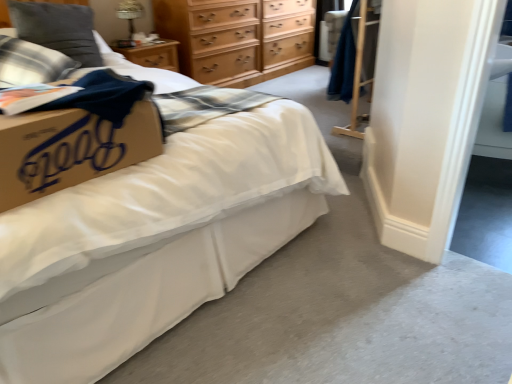
The height and width of the screenshot is (384, 512). Identify the location of plush gray pillow at upper left, which ranks as the 1th pillow in top-to-bottom order. (58, 29).

Measure the distance between white matte bed at center and camera.

The distance of white matte bed at center from camera is 38.50 inches.

At what (x,y) coordinates should I click in order to perform the action: click on white matte bed at center. Please return your answer as a coordinate pair (x, y). This screenshot has width=512, height=384. Looking at the image, I should click on (154, 241).

At what (x,y) coordinates should I click in order to perform the action: click on plush gray pillow at upper left, which is the 2th pillow in bottom-to-top order. Please return your answer as a coordinate pair (x, y). This screenshot has width=512, height=384. Looking at the image, I should click on (58, 29).

How many degrees apart are the facing directions of plush gray pillow at upper left, which is the 2th pillow in bottom-to-top order, and light brown wooden chest of drawers at upper center?

plush gray pillow at upper left, which is the 2th pillow in bottom-to-top order, and light brown wooden chest of drawers at upper center are facing 5.44 degrees away from each other.

Who is shorter, plush gray pillow at upper left, which is the 2th pillow in bottom-to-top order, or light brown wooden chest of drawers at upper center?

With less height is plush gray pillow at upper left, which is the 2th pillow in bottom-to-top order.

Looking at their sizes, would you say plush gray pillow at upper left, which is the 2th pillow in bottom-to-top order, is wider or thinner than light brown wooden chest of drawers at upper center?

Clearly, plush gray pillow at upper left, which is the 2th pillow in bottom-to-top order, has less width compared to light brown wooden chest of drawers at upper center.

Consider the image. Is light brown wooden chest of drawers at upper center with plaid fabric pillow at upper left, acting as the second pillow starting from the top?

No, light brown wooden chest of drawers at upper center is not in contact with plaid fabric pillow at upper left, acting as the second pillow starting from the top.

Considering the sizes of objects light brown wooden chest of drawers at upper center and plaid fabric pillow at upper left, which appears as the first pillow when ordered from the bottom, in the image provided, who is smaller, light brown wooden chest of drawers at upper center or plaid fabric pillow at upper left, which appears as the first pillow when ordered from the bottom,?

With smaller size is plaid fabric pillow at upper left, which appears as the first pillow when ordered from the bottom.

Is light brown wooden chest of drawers at upper center in front of or behind plaid fabric pillow at upper left, which appears as the first pillow when ordered from the bottom, in the image?

Visually, light brown wooden chest of drawers at upper center is located behind plaid fabric pillow at upper left, which appears as the first pillow when ordered from the bottom.

Measure the distance from light brown wooden chest of drawers at upper center to plaid fabric pillow at upper left, acting as the second pillow starting from the top.

light brown wooden chest of drawers at upper center and plaid fabric pillow at upper left, acting as the second pillow starting from the top, are 1.60 meters apart from each other.

Between plaid fabric pillow at upper left, acting as the second pillow starting from the top, and light brown wooden chest of drawers at upper center, which one is positioned behind?

light brown wooden chest of drawers at upper center is behind.

Is plaid fabric pillow at upper left, acting as the second pillow starting from the top, oriented away from light brown wooden chest of drawers at upper center?

plaid fabric pillow at upper left, acting as the second pillow starting from the top, does not have its back to light brown wooden chest of drawers at upper center.

Between plaid fabric pillow at upper left, acting as the second pillow starting from the top, and light brown wooden chest of drawers at upper center, which one has more height?

With more height is light brown wooden chest of drawers at upper center.

From a real-world perspective, between plaid fabric pillow at upper left, acting as the second pillow starting from the top, and light brown wooden chest of drawers at upper center, who is vertically lower?

light brown wooden chest of drawers at upper center, from a real-world perspective.

Is the position of white matte bed at center less distant than that of plush gray pillow at upper left, which ranks as the 1th pillow in top-to-bottom order?

Yes, the depth of white matte bed at center is less than that of plush gray pillow at upper left, which ranks as the 1th pillow in top-to-bottom order.

Between white matte bed at center and plush gray pillow at upper left, which ranks as the 1th pillow in top-to-bottom order, which one has less height?

Standing shorter between the two is plush gray pillow at upper left, which ranks as the 1th pillow in top-to-bottom order.

Considering the sizes of objects white matte bed at center and plush gray pillow at upper left, which ranks as the 1th pillow in top-to-bottom order, in the image provided, who is wider, white matte bed at center or plush gray pillow at upper left, which ranks as the 1th pillow in top-to-bottom order,?

With larger width is white matte bed at center.

Does point (170, 152) lie behind point (46, 30)?

No.

Looking at this image, which of these two, light brown wooden chest of drawers at upper center or white matte bed at center, is thinner?

light brown wooden chest of drawers at upper center.

The height and width of the screenshot is (384, 512). In order to click on bed in front of the light brown wooden chest of drawers at upper center in this screenshot , I will do `click(154, 241)`.

From the image's perspective, is light brown wooden chest of drawers at upper center on top of white matte bed at center?

Yes, from the image's perspective, light brown wooden chest of drawers at upper center is above white matte bed at center.

Looking at this image, does plaid fabric pillow at upper left, acting as the second pillow starting from the top, have a larger size compared to plush gray pillow at upper left, which is the 2th pillow in bottom-to-top order?

Yes.

From a real-world perspective, who is located higher, plaid fabric pillow at upper left, which appears as the first pillow when ordered from the bottom, or plush gray pillow at upper left, which ranks as the 1th pillow in top-to-bottom order?

plush gray pillow at upper left, which ranks as the 1th pillow in top-to-bottom order, from a real-world perspective.

From the image's perspective, between plaid fabric pillow at upper left, acting as the second pillow starting from the top, and plush gray pillow at upper left, which ranks as the 1th pillow in top-to-bottom order, who is located below?

plaid fabric pillow at upper left, acting as the second pillow starting from the top, appears lower in the image.

In terms of width, does plaid fabric pillow at upper left, which appears as the first pillow when ordered from the bottom, look wider or thinner when compared to plush gray pillow at upper left, which is the 2th pillow in bottom-to-top order?

In the image, plaid fabric pillow at upper left, which appears as the first pillow when ordered from the bottom, appears to be wider than plush gray pillow at upper left, which is the 2th pillow in bottom-to-top order.

Is plaid fabric pillow at upper left, acting as the second pillow starting from the top, to the left or to the right of white matte bed at center in the image?

plaid fabric pillow at upper left, acting as the second pillow starting from the top, is to the left of white matte bed at center.

Is the depth of plaid fabric pillow at upper left, which appears as the first pillow when ordered from the bottom, less than that of white matte bed at center?

No, it is not.

Is white matte bed at center at the back of plaid fabric pillow at upper left, acting as the second pillow starting from the top?

Yes, plaid fabric pillow at upper left, acting as the second pillow starting from the top, is positioned with its back facing white matte bed at center.

How different are the orientations of plaid fabric pillow at upper left, which appears as the first pillow when ordered from the bottom, and white matte bed at center in degrees?

36.6 degrees separate the facing orientations of plaid fabric pillow at upper left, which appears as the first pillow when ordered from the bottom, and white matte bed at center.

Where is `the chest of drawers below the plush gray pillow at upper left, which is the 2th pillow in bottom-to-top order (from a real-world perspective)`? The width and height of the screenshot is (512, 384). the chest of drawers below the plush gray pillow at upper left, which is the 2th pillow in bottom-to-top order (from a real-world perspective) is located at coordinates (238, 38).

Image resolution: width=512 pixels, height=384 pixels. Identify the location of chest of drawers above the plaid fabric pillow at upper left, acting as the second pillow starting from the top (from the image's perspective). (238, 38).

From the image, which object appears to be nearer to plaid fabric pillow at upper left, which appears as the first pillow when ordered from the bottom, plush gray pillow at upper left, which ranks as the 1th pillow in top-to-bottom order, or white matte bed at center?

plush gray pillow at upper left, which ranks as the 1th pillow in top-to-bottom order.

When comparing their distances from light brown wooden chest of drawers at upper center, does plaid fabric pillow at upper left, acting as the second pillow starting from the top, or plush gray pillow at upper left, which is the 2th pillow in bottom-to-top order, seem further?

plaid fabric pillow at upper left, acting as the second pillow starting from the top, is further to light brown wooden chest of drawers at upper center.

Estimate the real-world distances between objects in this image. Which object is further from light brown wooden chest of drawers at upper center, plush gray pillow at upper left, which ranks as the 1th pillow in top-to-bottom order, or plaid fabric pillow at upper left, acting as the second pillow starting from the top?

plaid fabric pillow at upper left, acting as the second pillow starting from the top, is further to light brown wooden chest of drawers at upper center.

From the picture: From the image, which object appears to be nearer to plush gray pillow at upper left, which ranks as the 1th pillow in top-to-bottom order, light brown wooden chest of drawers at upper center or plaid fabric pillow at upper left, acting as the second pillow starting from the top?

plaid fabric pillow at upper left, acting as the second pillow starting from the top, lies closer to plush gray pillow at upper left, which ranks as the 1th pillow in top-to-bottom order, than the other object.

When comparing their distances from plaid fabric pillow at upper left, which appears as the first pillow when ordered from the bottom, does light brown wooden chest of drawers at upper center or plush gray pillow at upper left, which ranks as the 1th pillow in top-to-bottom order, seem further?

light brown wooden chest of drawers at upper center is positioned further to the anchor plaid fabric pillow at upper left, which appears as the first pillow when ordered from the bottom.

Looking at the image, which one is located further to light brown wooden chest of drawers at upper center, white matte bed at center or plaid fabric pillow at upper left, acting as the second pillow starting from the top?

white matte bed at center.

Based on their spatial positions, is white matte bed at center or light brown wooden chest of drawers at upper center closer to plush gray pillow at upper left, which is the 2th pillow in bottom-to-top order?

light brown wooden chest of drawers at upper center is closer to plush gray pillow at upper left, which is the 2th pillow in bottom-to-top order.

Which object lies nearer to the anchor point white matte bed at center, light brown wooden chest of drawers at upper center or plaid fabric pillow at upper left, which appears as the first pillow when ordered from the bottom?

plaid fabric pillow at upper left, which appears as the first pillow when ordered from the bottom.

This screenshot has width=512, height=384. I want to click on pillow between white matte bed at center and plush gray pillow at upper left, which is the 2th pillow in bottom-to-top order, from front to back, so [31, 63].

Image resolution: width=512 pixels, height=384 pixels. Identify the location of pillow between plaid fabric pillow at upper left, acting as the second pillow starting from the top, and light brown wooden chest of drawers at upper center from front to back. (58, 29).